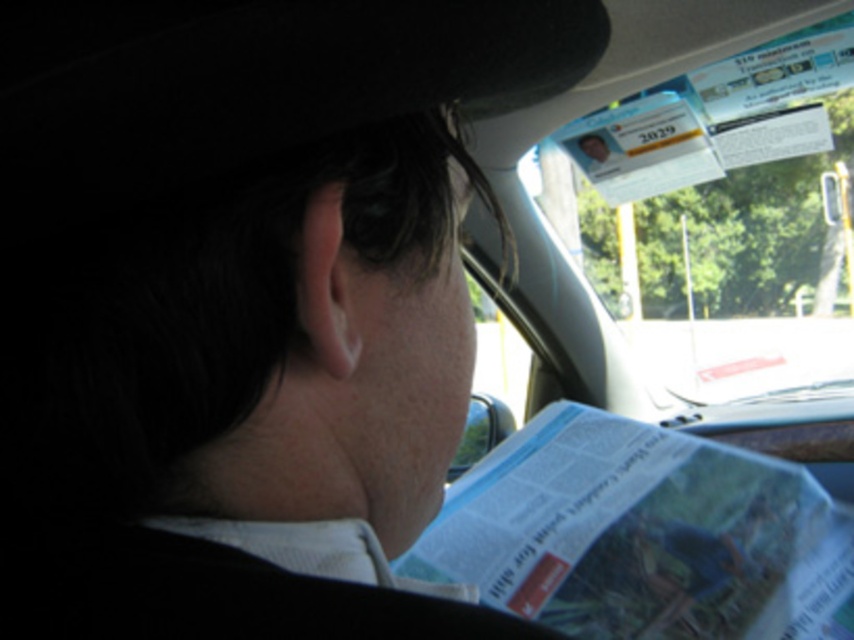
Which is behind, point (782, 506) or point (665, 51)?

Positioned behind is point (665, 51).

Which is in front, point (529, 520) or point (674, 364)?

Point (529, 520) is in front.

Identify the location of white glossy paper at lower center. (642, 534).

Locate an element on the screen. white glossy paper at lower center is located at coordinates point(642,534).